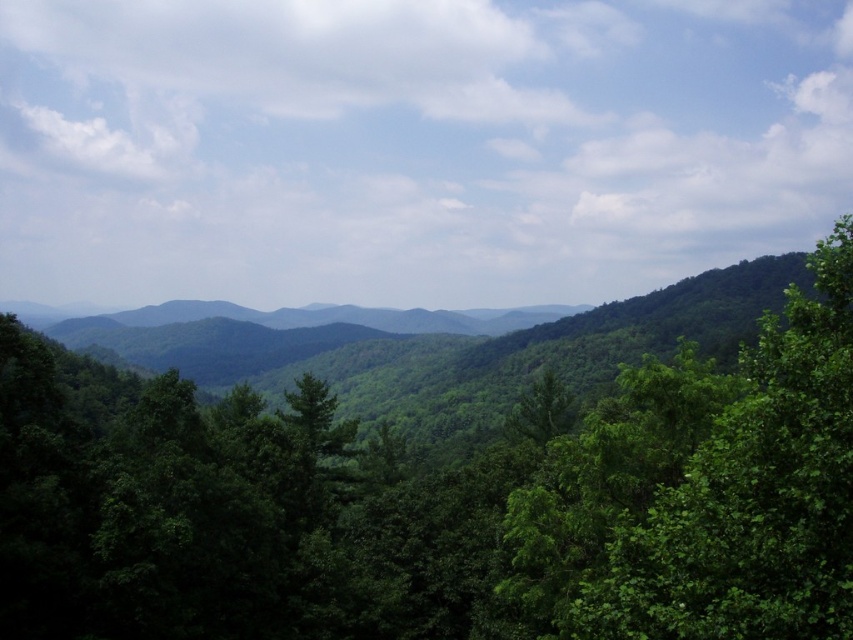
Measure the distance between point (321,584) and camera.

A distance of 38.40 meters exists between point (321,584) and camera.

Is green leafy tree at center positioned at the back of green leafy tree at right?

Yes, green leafy tree at center is behind green leafy tree at right.

Find the location of `green leafy tree at center`. green leafy tree at center is located at coordinates (439, 502).

Locate an element on the screen. green leafy tree at center is located at coordinates (439, 502).